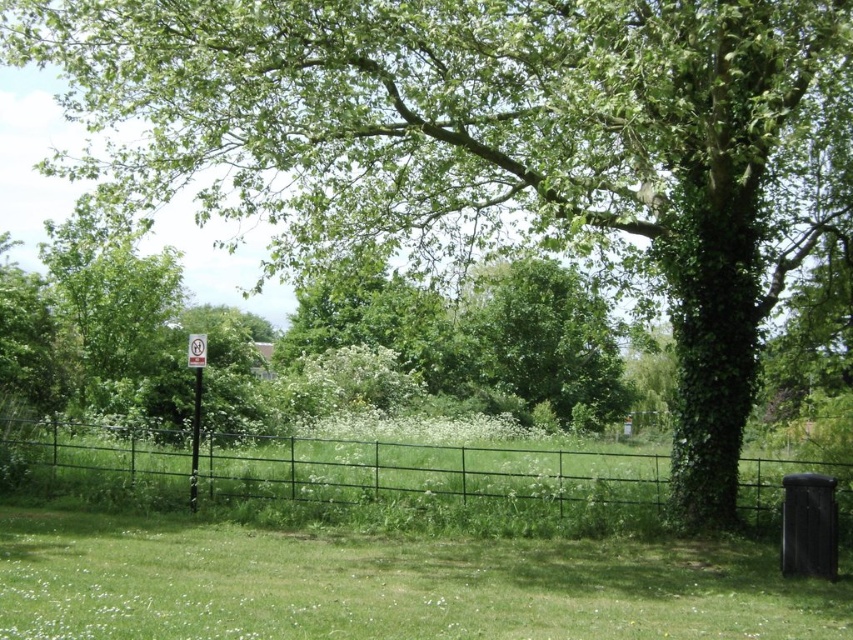
Who is positioned more to the right, green grassy at lower center or metallic signpost at left?

green grassy at lower center

Image resolution: width=853 pixels, height=640 pixels. Identify the location of green grassy at lower center. [389, 586].

Is point (74, 432) positioned in front of point (555, 298)?

Yes, point (74, 432) is in front of point (555, 298).

Between green metal fence at center and green leafy tree at center, which one is positioned lower?

green metal fence at center is lower down.

Is point (175, 452) closer to camera compared to point (502, 380)?

Yes, point (175, 452) is closer to viewer.

Locate an element on the screen. This screenshot has width=853, height=640. green metal fence at center is located at coordinates (422, 472).

Does green metal fence at center appear on the left side of metallic signpost at left?

In fact, green metal fence at center is to the right of metallic signpost at left.

Which is in front, point (305, 452) or point (190, 477)?

Point (190, 477) is more forward.

This screenshot has width=853, height=640. Identify the location of green metal fence at center. (422, 472).